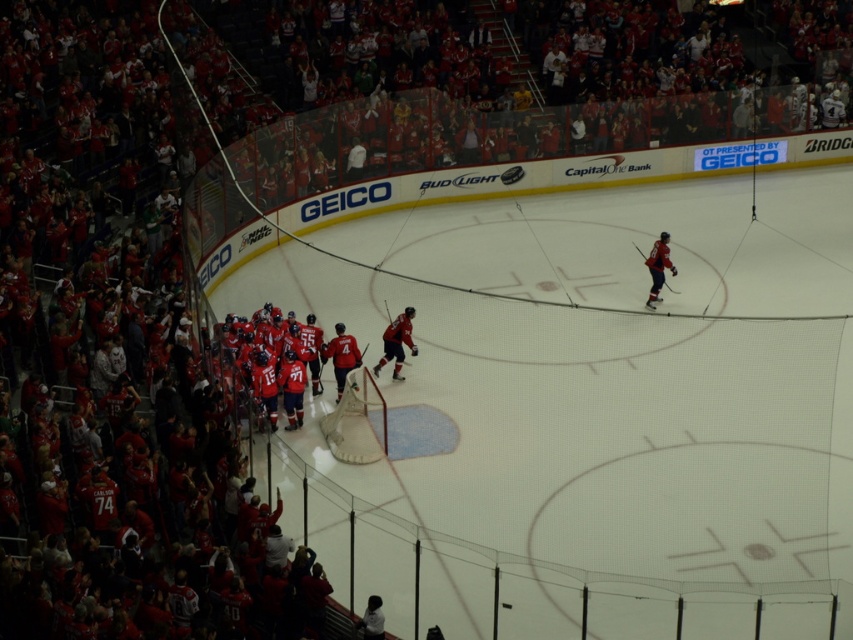
You are a photographer positioned at the back of the rink. You want to capture a photo of both the matte red jersey at center and the matte red jersey at right without any obstructions. Based on their positions, which jersey should you focus on first to ensure both are visible?

The matte red jersey at center is in front of the matte red jersey at right, so you should focus on the matte red jersey at right first to ensure both are visible without obstruction.

You are a photographer standing at the edge of the ice rink. You want to take a photo of the matte red jersey at center from a distance that is exactly 70 feet away. Is the current distance sufficient for your requirement?

The matte red jersey at center is 68.90 feet away from the camera, which is slightly less than the required 70 feet. To achieve the desired distance, you would need to move back approximately 1.1 feet.